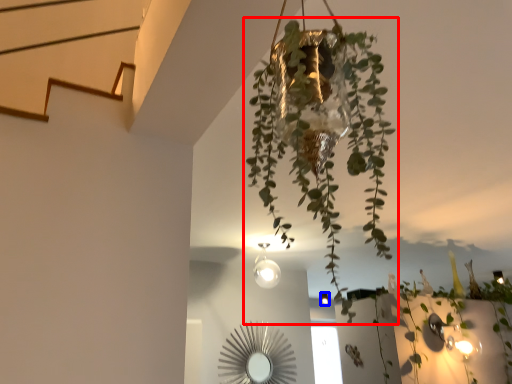
Question: Among these objects, which one is nearest to the camera, houseplant (highlighted by a red box) or light fixture (highlighted by a blue box)?

Choices:
 (A) houseplant
 (B) light fixture

Answer: (A)